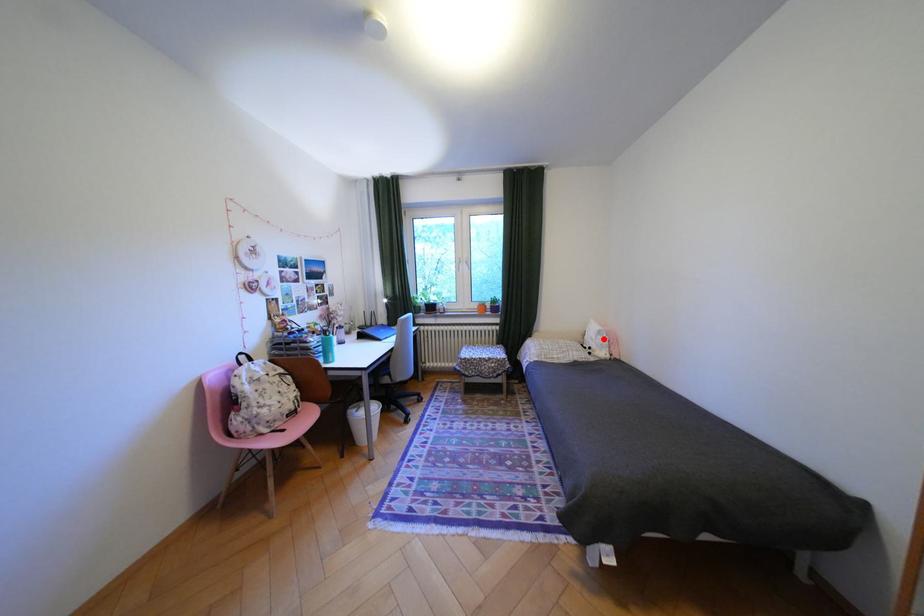
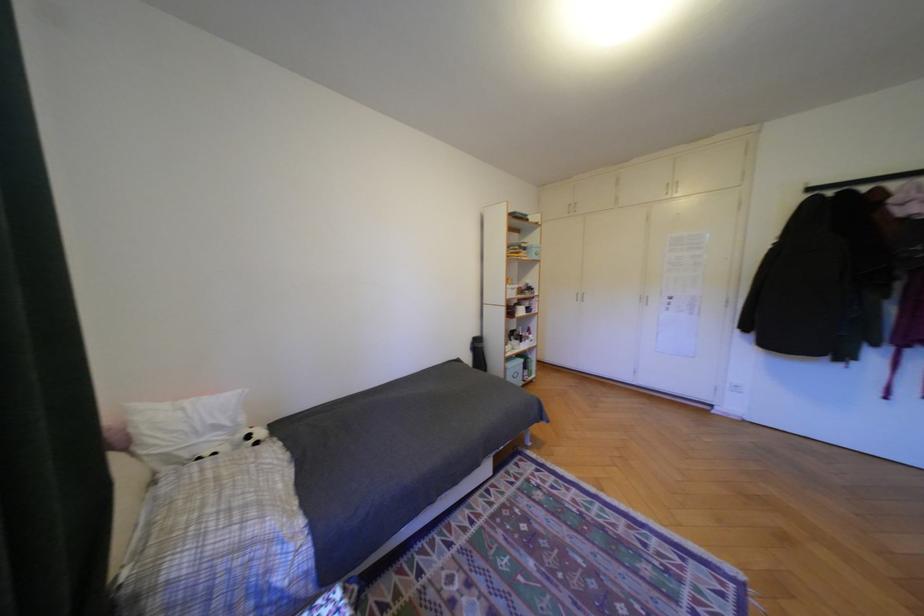
Question: I am providing you with two images of the same scene from different viewpoints. In image1, a red point is highlighted. Considering the same 3D point in image2, which of the following is correct?

Choices:
 (A) It is closer
 (B) It is farther

Answer: (B)